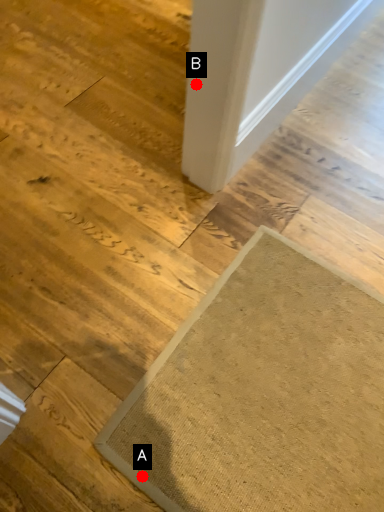
Question: Two points are circled on the image, labeled by A and B beside each circle. Among these points, which one is nearest to the camera?

Choices:
 (A) A is closer
 (B) B is closer

Answer: (A)